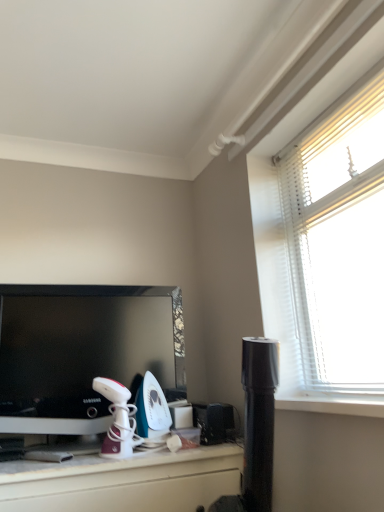
Question: Would you say teal glossy iron at center, acting as the 2th appliance starting from the right, is outside white glossy iron at center, arranged as the third appliance when viewed from the right?

Choices:
 (A) yes
 (B) no

Answer: (A)

Question: Is white glossy iron at center, arranged as the third appliance when viewed from the right, a part of teal glossy iron at center, the second appliance positioned from the left?

Choices:
 (A) yes
 (B) no

Answer: (B)

Question: Is teal glossy iron at center, the second appliance positioned from the left, facing towards white glossy iron at center, marked as the first appliance in a left-to-right arrangement?

Choices:
 (A) no
 (B) yes

Answer: (A)

Question: Does teal glossy iron at center, acting as the 2th appliance starting from the right, have a greater height compared to white glossy iron at center, arranged as the third appliance when viewed from the right?

Choices:
 (A) yes
 (B) no

Answer: (A)

Question: Is teal glossy iron at center, acting as the 2th appliance starting from the right, with white glossy iron at center, arranged as the third appliance when viewed from the right?

Choices:
 (A) yes
 (B) no

Answer: (A)

Question: Does point (167, 409) appear closer or farther from the camera than point (218, 442)?

Choices:
 (A) closer
 (B) farther

Answer: (B)

Question: From the image's perspective, relative to black plastic speaker at lower center, arranged as the first appliance when viewed from the right, is teal glossy iron at center, the second appliance positioned from the left, above or below?

Choices:
 (A) above
 (B) below

Answer: (A)

Question: Looking at their shapes, would you say teal glossy iron at center, the second appliance positioned from the left, is wider or thinner than black plastic speaker at lower center, which ranks as the third appliance in left-to-right order?

Choices:
 (A) wide
 (B) thin

Answer: (A)

Question: Choose the correct answer: Is teal glossy iron at center, acting as the 2th appliance starting from the right, inside black plastic speaker at lower center, which ranks as the third appliance in left-to-right order, or outside it?

Choices:
 (A) outside
 (B) inside

Answer: (A)

Question: From a real-world perspective, is teal glossy iron at center, acting as the 2th appliance starting from the right, positioned above or below white glossy iron at center, marked as the first appliance in a left-to-right arrangement?

Choices:
 (A) below
 (B) above

Answer: (B)

Question: Is point (167, 409) closer or farther from the camera than point (120, 412)?

Choices:
 (A) closer
 (B) farther

Answer: (B)

Question: Is teal glossy iron at center, acting as the 2th appliance starting from the right, situated inside white glossy iron at center, arranged as the third appliance when viewed from the right, or outside?

Choices:
 (A) inside
 (B) outside

Answer: (B)

Question: Relative to white glossy iron at center, arranged as the third appliance when viewed from the right, is teal glossy iron at center, acting as the 2th appliance starting from the right, in front or behind?

Choices:
 (A) front
 (B) behind

Answer: (B)

Question: Which is correct: teal glossy iron at center, the second appliance positioned from the left, is inside black glossy television at left, or outside of it?

Choices:
 (A) outside
 (B) inside

Answer: (B)

Question: In the image, is teal glossy iron at center, acting as the 2th appliance starting from the right, positioned in front of or behind black glossy television at left?

Choices:
 (A) behind
 (B) front

Answer: (A)